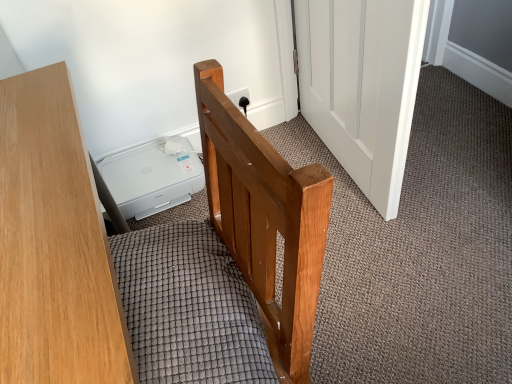
This screenshot has width=512, height=384. What do you see at coordinates (54, 244) in the screenshot?
I see `wooden desk at left` at bounding box center [54, 244].

Image resolution: width=512 pixels, height=384 pixels. What do you see at coordinates (362, 85) in the screenshot?
I see `white wooden door at center` at bounding box center [362, 85].

Where is `wooden desk at left`? The height and width of the screenshot is (384, 512). wooden desk at left is located at coordinates (54, 244).

From the image's perspective, between textured gray mattress at center and wooden desk at left, who is located below?

From the image's view, wooden desk at left is below.

Does textured gray mattress at center come in front of wooden desk at left?

No.

Who is shorter, textured gray mattress at center or wooden desk at left?

With less height is textured gray mattress at center.

Considering the sizes of textured gray mattress at center and wooden desk at left in the image, is textured gray mattress at center bigger or smaller than wooden desk at left?

In the image, textured gray mattress at center appears to be smaller than wooden desk at left.

How many degrees apart are the facing directions of textured gray mattress at center and white wooden door at center?

The angle between the facing direction of textured gray mattress at center and the facing direction of white wooden door at center is 2.97 degrees.

Is textured gray mattress at center next to white wooden door at center?

No, textured gray mattress at center is not in contact with white wooden door at center.

In the image, is textured gray mattress at center positioned in front of or behind white wooden door at center?

In the image, textured gray mattress at center appears in front of white wooden door at center.

From a real-world perspective, is textured gray mattress at center positioned above or below white wooden door at center?

In terms of real-world spatial position, textured gray mattress at center is above white wooden door at center.

From a real-world perspective, is white wooden door at center located higher than textured gray mattress at center?

No, from a real-world perspective, white wooden door at center is not over textured gray mattress at center

Identify the location of door lying above the textured gray mattress at center (from the image's perspective). (362, 85).

Which object is thinner, white wooden door at center or textured gray mattress at center?

white wooden door at center is thinner.

Measure the distance from white wooden door at center to textured gray mattress at center.

white wooden door at center is 31.97 inches away from textured gray mattress at center.

Considering the relative sizes of wooden desk at left and white wooden door at center in the image provided, is wooden desk at left thinner than white wooden door at center?

In fact, wooden desk at left might be wider than white wooden door at center.

In the scene shown: Can you tell me how much wooden desk at left and white wooden door at center differ in facing direction?

178 degrees separate the facing orientations of wooden desk at left and white wooden door at center.

Can you confirm if wooden desk at left is smaller than white wooden door at center?

No.

Does wooden desk at left appear on the left side of white wooden door at center?

Indeed, wooden desk at left is positioned on the left side of white wooden door at center.

Based on the photo, how distant is white wooden door at center from wooden desk at left?

white wooden door at center and wooden desk at left are 35.40 inches apart from each other.

Considering their positions, is white wooden door at center located in front of or behind wooden desk at left?

Clearly, white wooden door at center is behind wooden desk at left.

Locate an element on the screen. The image size is (512, 384). door that is on the right side of wooden desk at left is located at coordinates (362, 85).

How different are the orientations of white wooden door at center and wooden desk at left in degrees?

178 degrees separate the facing orientations of white wooden door at center and wooden desk at left.

Is wooden desk at left oriented towards textured gray mattress at center?

Yes, wooden desk at left faces towards textured gray mattress at center.

Identify the location of furniture in front of the textured gray mattress at center. (54, 244).

From the image's perspective, who appears lower, wooden desk at left or textured gray mattress at center?

wooden desk at left, from the image's perspective.

Find the location of `furniture in front of the textured gray mattress at center`. furniture in front of the textured gray mattress at center is located at coordinates (54, 244).

Locate an element on the screen. bedding lying on the left of white wooden door at center is located at coordinates (189, 308).

Considering their positions, is wooden desk at left positioned further to textured gray mattress at center than white wooden door at center?

white wooden door at center is further to textured gray mattress at center.

From the image, which object appears to be farther from white wooden door at center, textured gray mattress at center or wooden desk at left?

Among the two, wooden desk at left is located further to white wooden door at center.

Looking at the image, which one is located further to white wooden door at center, wooden desk at left or textured gray mattress at center?

wooden desk at left lies further to white wooden door at center than the other object.

Which object lies further to the anchor point wooden desk at left, white wooden door at center or textured gray mattress at center?

white wooden door at center lies further to wooden desk at left than the other object.

Looking at the image, which one is located closer to wooden desk at left, textured gray mattress at center or white wooden door at center?

textured gray mattress at center is closer to wooden desk at left.

From the image, which object appears to be farther from textured gray mattress at center, white wooden door at center or wooden desk at left?

white wooden door at center is positioned further to the anchor textured gray mattress at center.

You are a GUI agent. You are given a task and a screenshot of the screen. Output one action in this format:
    pyautogui.click(x=<x>, y=<y>)
    Task: Click on the bedding situated between wooden desk at left and white wooden door at center from left to right
    This screenshot has height=384, width=512.
    Given the screenshot: What is the action you would take?
    pyautogui.click(x=189, y=308)